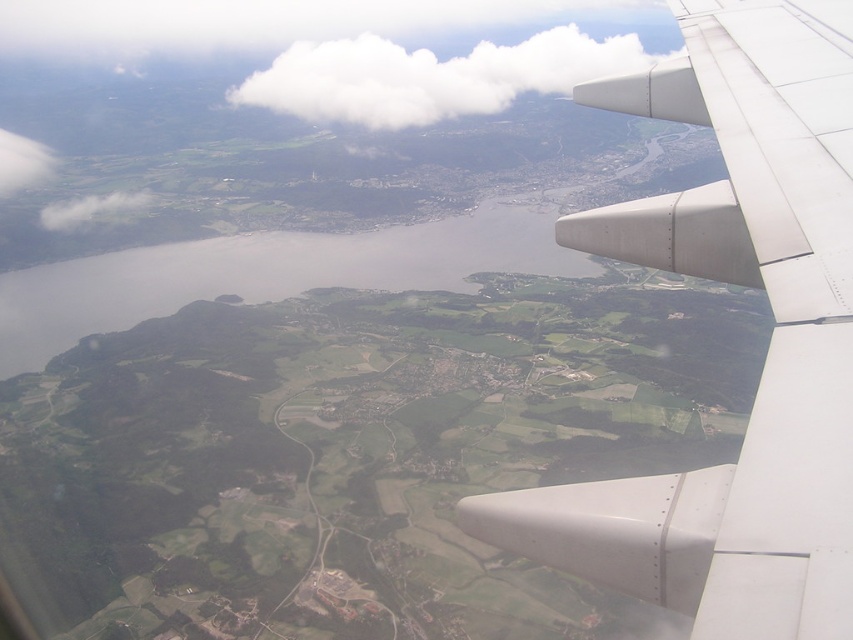
Between metallic gray wing at right and white fluffy cloud at upper center, which one is positioned lower?

metallic gray wing at right

Is metallic gray wing at right smaller than white fluffy cloud at upper center?

Yes, metallic gray wing at right is smaller than white fluffy cloud at upper center.

Where is `metallic gray wing at right`? The image size is (853, 640). metallic gray wing at right is located at coordinates (769, 342).